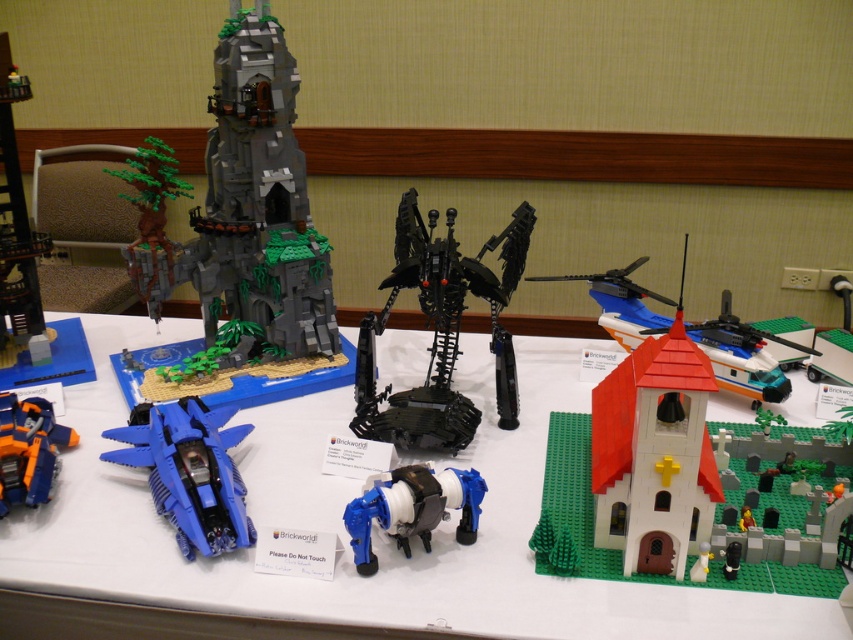
Between point (750, 384) and point (346, 515), which one is positioned in front?

Point (346, 515) is in front.

Is point (737, 326) positioned before point (374, 570)?

No, (737, 326) is behind (374, 570).

Between point (724, 326) and point (376, 483), which one is positioned in front?

Point (376, 483) is more forward.

You are a GUI agent. You are given a task and a screenshot of the screen. Output one action in this format:
    pyautogui.click(x=<x>, y=<y>)
    Task: Click on the white matte church at center-right
    
    Given the screenshot: What is the action you would take?
    point(689,332)

Does dark gray stone tower at upper left have a greater height compared to white matte church at center-right?

Yes, dark gray stone tower at upper left is taller than white matte church at center-right.

Consider the image. Who is more forward, (213,154) or (712,368)?

Point (712,368) is in front.

Measure the distance between point [292,116] and camera.

Point [292,116] is 4.78 feet from camera.

Identify the location of dark gray stone tower at upper left. (250, 212).

Who is shorter, matte blue plastic fighter jet at lower left or blue plastic robot at center?

Standing shorter between the two is blue plastic robot at center.

Does matte blue plastic fighter jet at lower left appear on the right side of blue plastic robot at center?

In fact, matte blue plastic fighter jet at lower left is to the left of blue plastic robot at center.

Which is behind, point (192, 477) or point (474, 488)?

Point (192, 477)

This screenshot has width=853, height=640. I want to click on matte blue plastic fighter jet at lower left, so click(190, 472).